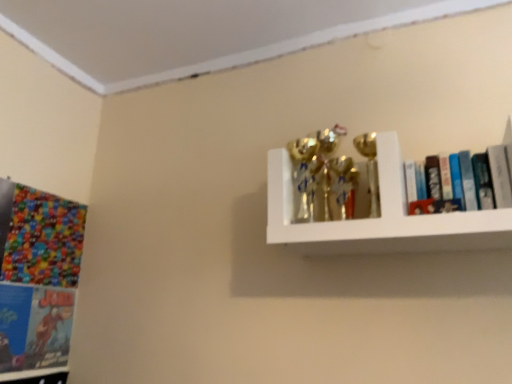
Question: Relative to white glossy shelf at upper right, is multicolored glossy comic book at left in front or behind?

Choices:
 (A) behind
 (B) front

Answer: (A)

Question: In terms of height, does multicolored glossy comic book at left look taller or shorter compared to white glossy shelf at upper right?

Choices:
 (A) tall
 (B) short

Answer: (A)

Question: Which of these objects is positioned farthest from the white glossy shelf at upper right?

Choices:
 (A) hardcover books at upper right, arranged as the first book when viewed from the right
 (B) matte blue book at lower left, the 1th book from the bottom
 (C) multicolored glossy comic book at left

Answer: (B)

Question: Which object is the closest to the multicolored glossy comic book at left?

Choices:
 (A) white glossy shelf at upper right
 (B) hardcover books at upper right, acting as the 2th book starting from the left
 (C) matte blue book at lower left, acting as the 2th book starting from the top

Answer: (C)